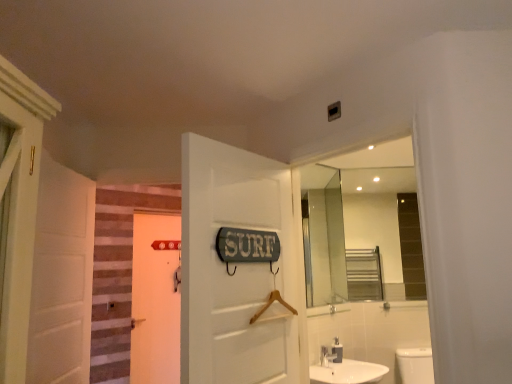
Question: Does white matte door at left, arranged as the second door when viewed from the back, turn towards brown striped carpet at left?

Choices:
 (A) no
 (B) yes

Answer: (A)

Question: Is white matte door at left, the 3th door in the right-to-left sequence, closer to the viewer compared to brown striped carpet at left?

Choices:
 (A) yes
 (B) no

Answer: (A)

Question: Can you confirm if white matte door at left, the 3th door in the right-to-left sequence, is positioned to the left of brown striped carpet at left?

Choices:
 (A) no
 (B) yes

Answer: (B)

Question: From the image's perspective, is white matte door at left, the 3th door in the right-to-left sequence, below brown striped carpet at left?

Choices:
 (A) no
 (B) yes

Answer: (A)

Question: Can you confirm if white matte door at left, the 1th door in the left-to-right sequence, is smaller than brown striped carpet at left?

Choices:
 (A) no
 (B) yes

Answer: (A)

Question: Does white matte door at left, arranged as the second door when viewed from the back, appear on the right side of brown striped carpet at left?

Choices:
 (A) yes
 (B) no

Answer: (B)

Question: From the image's perspective, is metallic silver soap dispenser at lower center beneath white matte door at left, the 1th door in the left-to-right sequence?

Choices:
 (A) no
 (B) yes

Answer: (B)

Question: Does metallic silver soap dispenser at lower center have a smaller size compared to white matte door at left, arranged as the second door when viewed from the back?

Choices:
 (A) no
 (B) yes

Answer: (B)

Question: Is metallic silver soap dispenser at lower center shorter than white matte door at left, the 2th door from the front?

Choices:
 (A) yes
 (B) no

Answer: (A)

Question: Is metallic silver soap dispenser at lower center to the left of white matte door at left, the 3th door in the right-to-left sequence, from the viewer's perspective?

Choices:
 (A) yes
 (B) no

Answer: (B)

Question: From the image's perspective, is metallic silver soap dispenser at lower center over white matte door at left, the 1th door in the left-to-right sequence?

Choices:
 (A) no
 (B) yes

Answer: (A)

Question: Is metallic silver soap dispenser at lower center not near white matte door at left, the 3th door in the right-to-left sequence?

Choices:
 (A) no
 (B) yes

Answer: (B)

Question: Would you say white matte door at left, the 2th door from the front, is part of white glossy sink at lower center's contents?

Choices:
 (A) no
 (B) yes

Answer: (A)